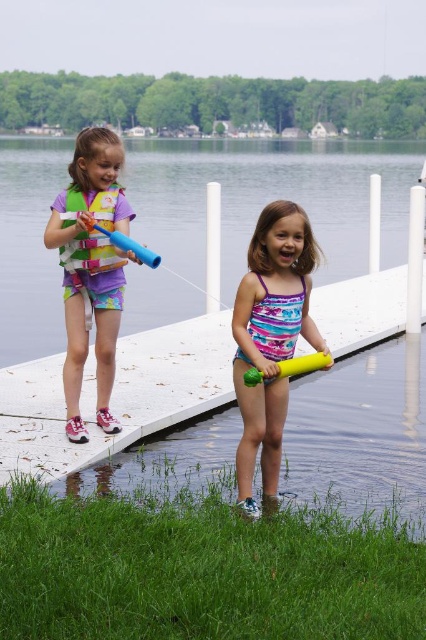
Is point (25, 266) closer to viewer compared to point (143, 250)?

No, (25, 266) is behind (143, 250).

Is point (402, 195) positioned before point (103, 230)?

No, (402, 195) is behind (103, 230).

This screenshot has height=640, width=426. I want to click on transparent plastic water at center, so click(268, 198).

Is matte yellow float at center shorter than blue rubber tube at upper left?

No, matte yellow float at center is not shorter than blue rubber tube at upper left.

Does matte yellow float at center come behind blue rubber tube at upper left?

No, matte yellow float at center is in front of blue rubber tube at upper left.

Between point (247, 465) and point (149, 257), which one is positioned behind?

The point (149, 257) is behind.

Find the location of a particular element. The width and height of the screenshot is (426, 640). matte yellow float at center is located at coordinates (270, 337).

Does point (313, 344) lie behind point (302, 369)?

Yes, it is behind point (302, 369).

Where is `matte yellow float at center`? matte yellow float at center is located at coordinates (270, 337).